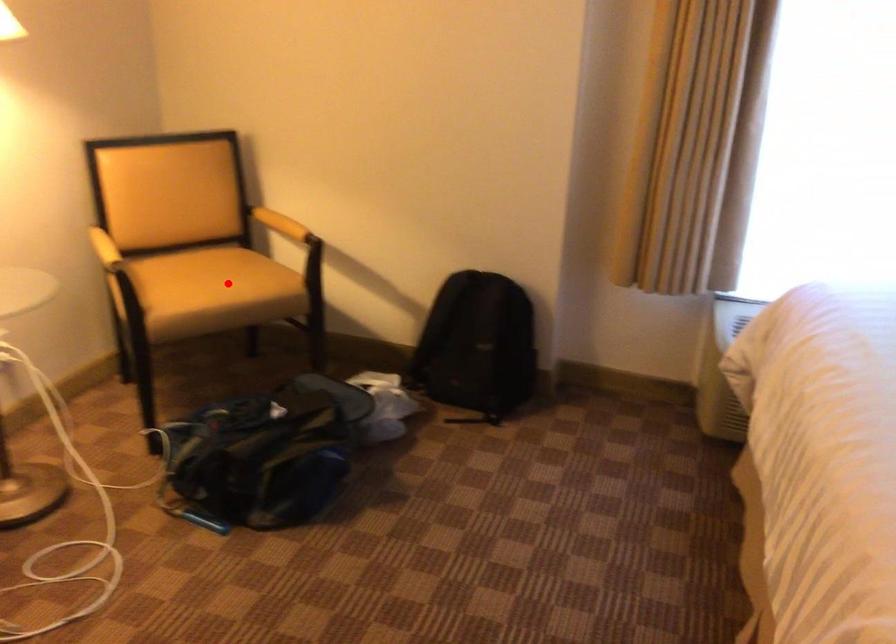
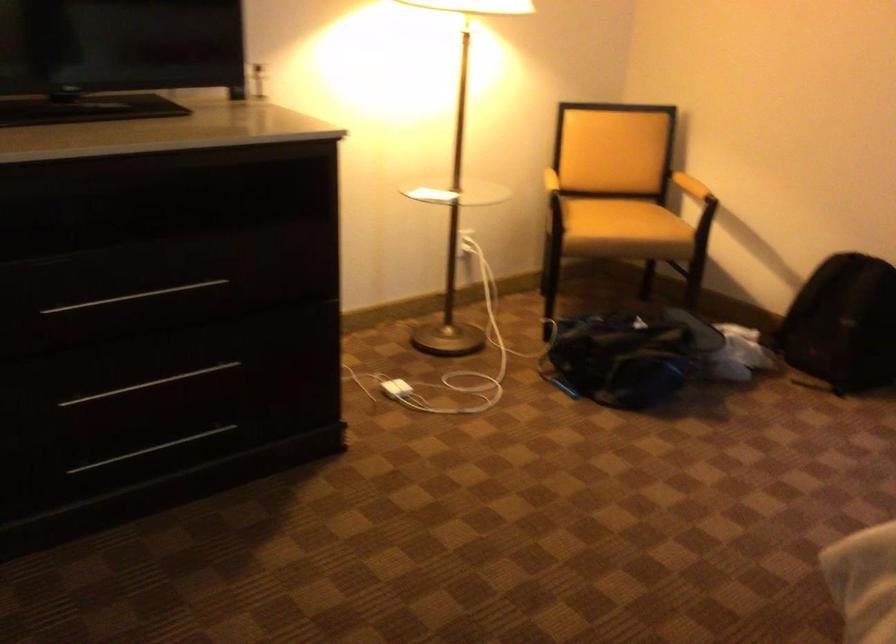
The point at the highlighted location is marked in the first image. Where is the corresponding point in the second image?

(623, 220)